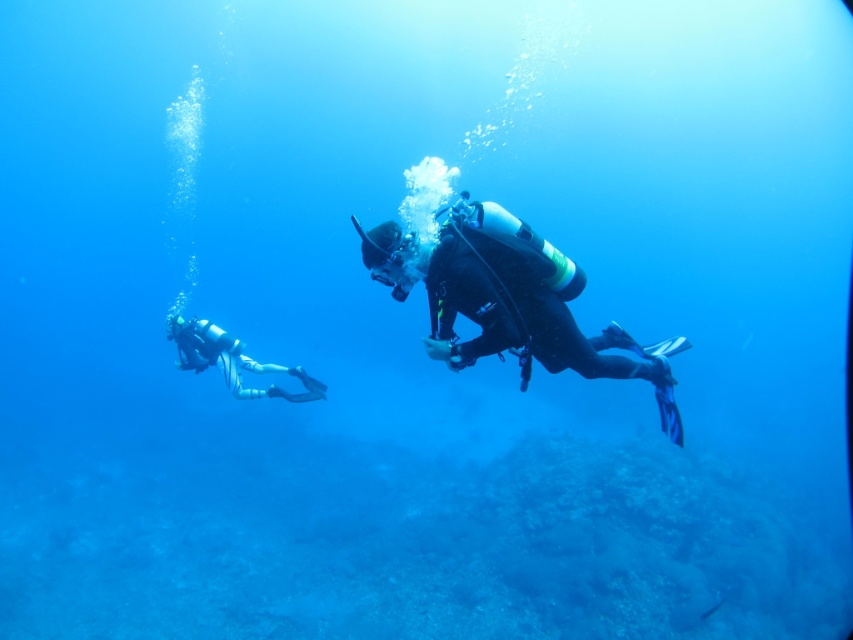
You are a marine biologist preparing to dive into the ocean. You see the black matte scuba diver at center in the water. Can you safely approach within 4 meters of them without disturbing their dive?

The black matte scuba diver at center is 3.88 meters away from viewer, so yes, you can safely approach within 4 meters of them without disturbing their dive since the distance is within the safe range.

You are a marine biologist observing underwater. You need to determine which scuba diver is wider between the black matte scuba diver at center and the white matte scuba diver at lower left. Which one is wider?

The black matte scuba diver at center is wider than the white matte scuba diver at lower left according to the description.